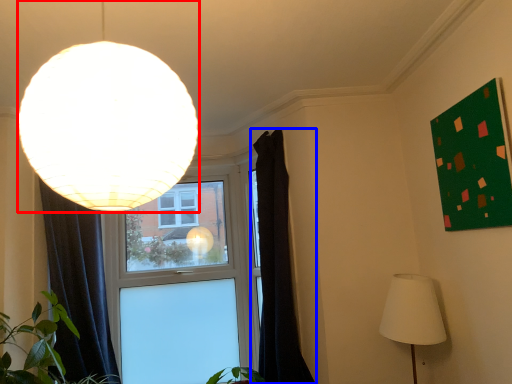
Question: Which object appears closest to the camera in this image, lamp (highlighted by a red box) or curtain (highlighted by a blue box)?

Choices:
 (A) lamp
 (B) curtain

Answer: (A)